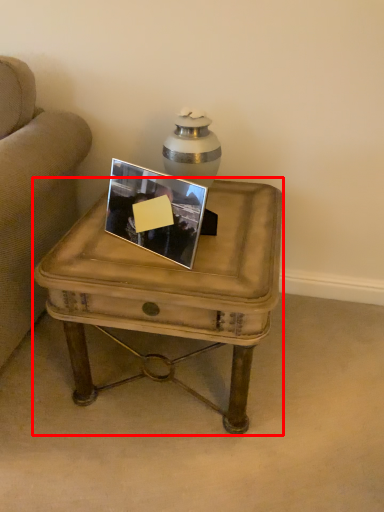
Question: In this image, where is coffee table (annotated by the red box) located relative to picture frame?

Choices:
 (A) right
 (B) left

Answer: (A)